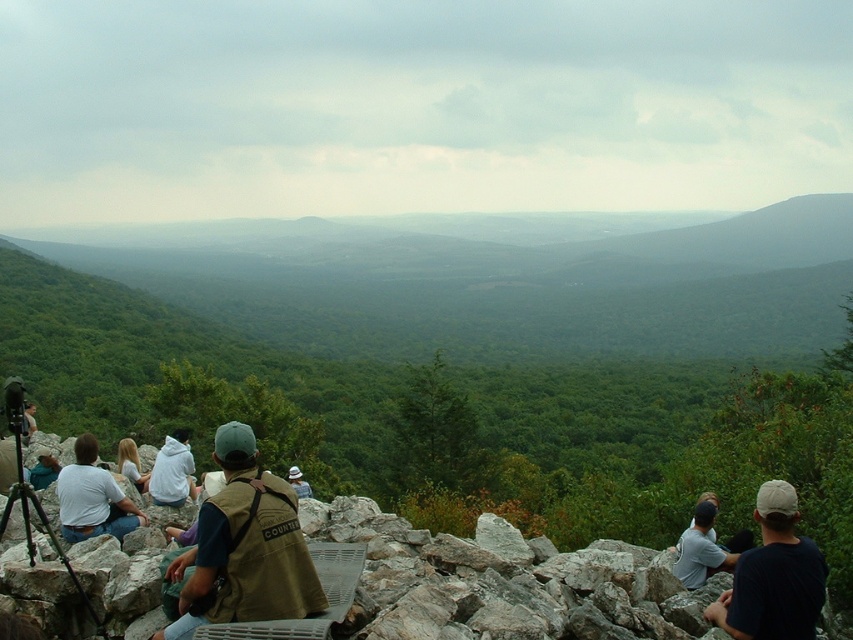
Question: Among these points, which one is nearest to the camera?

Choices:
 (A) (798, 513)
 (B) (305, 563)
 (C) (117, 445)
 (D) (704, 531)

Answer: (B)

Question: Which is farther from the white hoodie at lower left?

Choices:
 (A) black matte tripod at lower left
 (B) white cotton shirt at lower left
 (C) brown canvas vest at center

Answer: (C)

Question: Considering the relative positions of black matte tripod at lower left and white hoodie at lower left in the image provided, where is black matte tripod at lower left located with respect to white hoodie at lower left?

Choices:
 (A) below
 (B) above

Answer: (B)

Question: Is white hoodie at left positioned in front of khaki fabric hat at center?

Choices:
 (A) no
 (B) yes

Answer: (B)

Question: Estimate the real-world distances between objects in this image. Which object is farther from the black matte tripod at lower left?

Choices:
 (A) brown canvas vest at center
 (B) white hoodie at lower left
 (C) khaki fabric hat at center

Answer: (C)

Question: Is white cotton shirt at lower left positioned before khaki fabric hat at center?

Choices:
 (A) no
 (B) yes

Answer: (B)